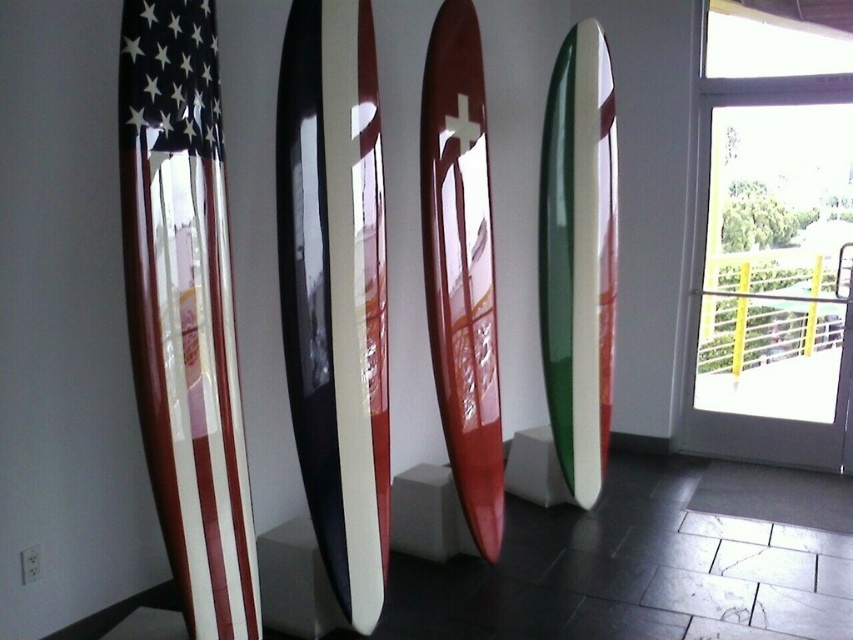
You are standing in the lobby and want to find the white glossy surfboard at center. According to the coordinates provided, where exactly is it positioned?

The white glossy surfboard at center is located at point coordinates (335, 291).

You are an interior designer planning to place a 1.5 meter wide decorative panel between the shiny metallic flag at left and the white glossy surfboard at center. Based on their widths, will the panel fit between them?

The shiny metallic flag at left is narrower than the white glossy surfboard at center. Since the panel is 1.5 meters wide, it depends on the actual widths. However, the description only states the flag is less wide than the surfboard, but without specific measurements, we cannot confirm if the panel will fit. More information is needed.